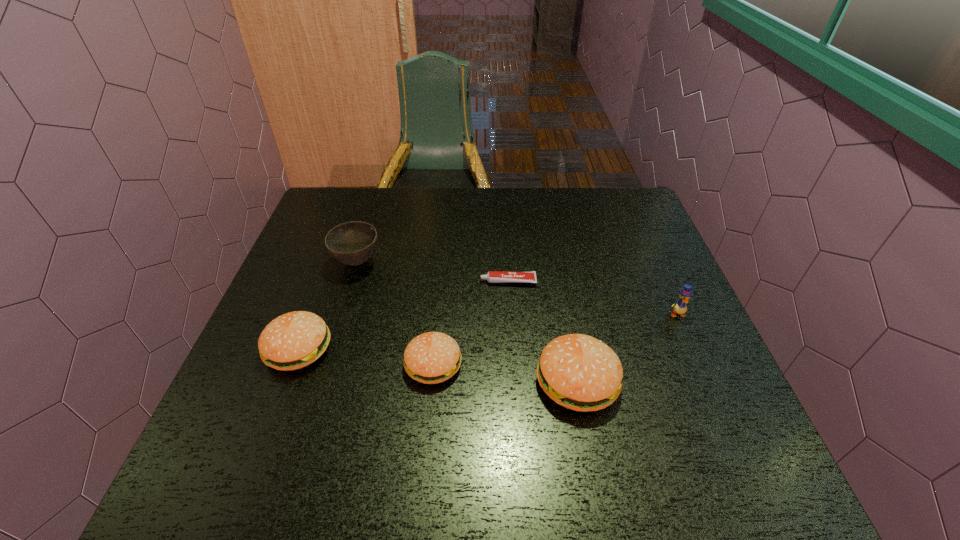
Identify which patty is located as the nearest to the rightmost patty. Please provide its 2D coordinates. Your answer should be formatted as a tuple, i.e. [(x, y)], where the tuple contains the x and y coordinates of a point satisfying the conditions above.

[(433, 357)]

Locate an element on the screen. Image resolution: width=960 pixels, height=540 pixels. vacant space that satisfies the following two spatial constraints: 1. at the nozzle of the rightmost patty; 2. on the right side of the shortest object is located at coordinates (515, 381).

This screenshot has width=960, height=540. I want to click on vacant space that satisfies the following two spatial constraints: 1. at the nozzle of the toothpaste; 2. on the back side of the rightmost patty, so click(515, 381).

Find the location of a particular element. This screenshot has height=540, width=960. vacant area that satisfies the following two spatial constraints: 1. on the front side of the rightmost patty; 2. on the right side of the bowl is located at coordinates (321, 381).